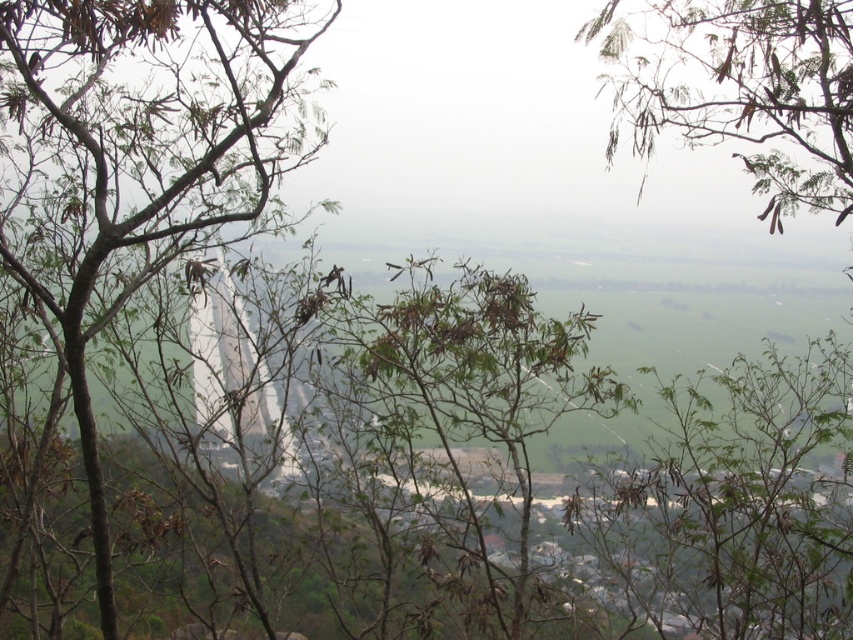
Looking at this image, you are an artist sketching the view from the hilltop. You notice two brown trees at the center of your drawing. Which tree is more to the left when looking at the brown leafy tree at center and the brown textured tree at center?

The brown leafy tree at center is more to the left side of the brown textured tree at center.

You are standing at the top of the hill and want to take a photo of both the brown leafy tree at center and the brown textured tree at center. Which tree should you focus on first to ensure both are in clear view?

You should focus on the brown leafy tree at center first because it is closer to you than the brown textured tree at center, so adjusting focus from near to far will help both be in clear view.